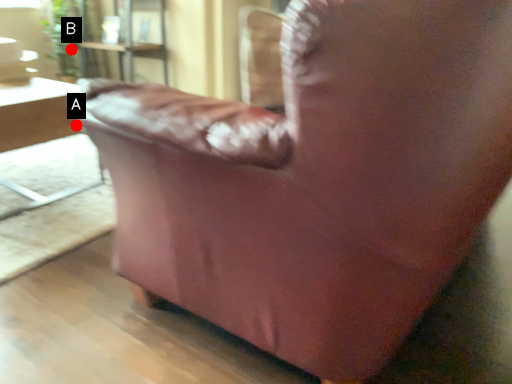
Question: Two points are circled on the image, labeled by A and B beside each circle. Which of the following is the closest to the observer?

Choices:
 (A) A is closer
 (B) B is closer

Answer: (A)